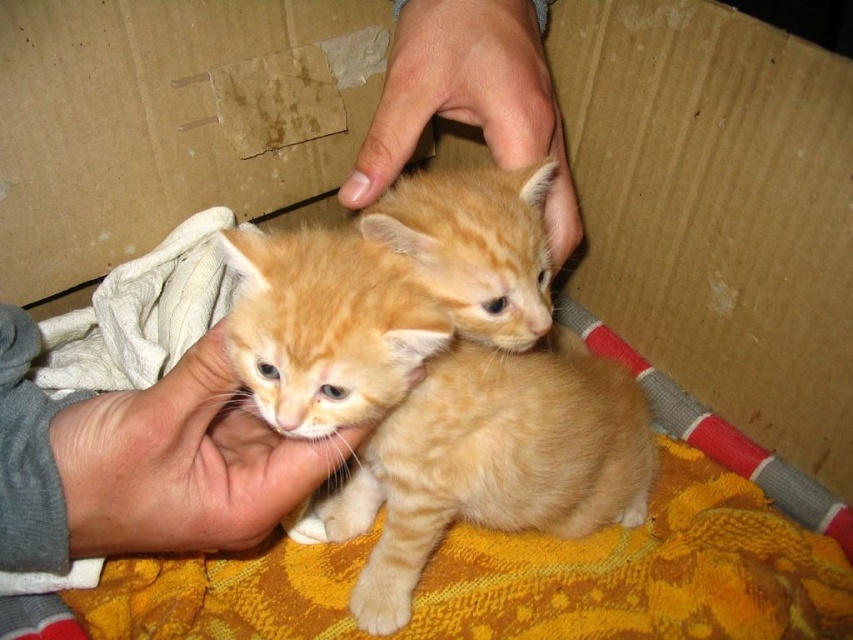
You are a veterinarian assessing the safety of placing a small medical kit between the orange tabby kitten at center and the smooth skin hand at upper center. The medical kit is 24 centimeters long. Can it fit between them without touching either?

The distance between the orange tabby kitten at center and the smooth skin hand at upper center is 25.07 centimeters. Since the medical kit is 24 centimeters long, it can fit between them as it is shorter than the available space.

You are a veterinarian examining two kittens in an image. You see an orange fur kittens at center and an orange tabby kitten at center. Which of these two kittens is located more to the left?

The orange fur kittens at center is more to the left because it is positioned on the left side of the orange tabby kitten at center.

You are a veterinarian examining two kittens. You see the orange fur kittens at center and the smooth skin hand at upper center. Which object is located to the left of the other?

The orange fur kittens at center is positioned on the left side of smooth skin hand at upper center.